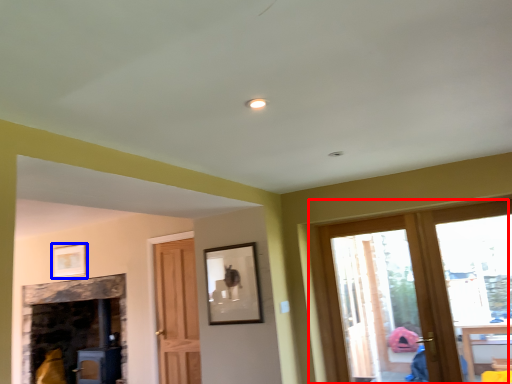
Question: Which object appears closest to the camera in this image, window (highlighted by a red box) or picture frame (highlighted by a blue box)?

Choices:
 (A) window
 (B) picture frame

Answer: (A)